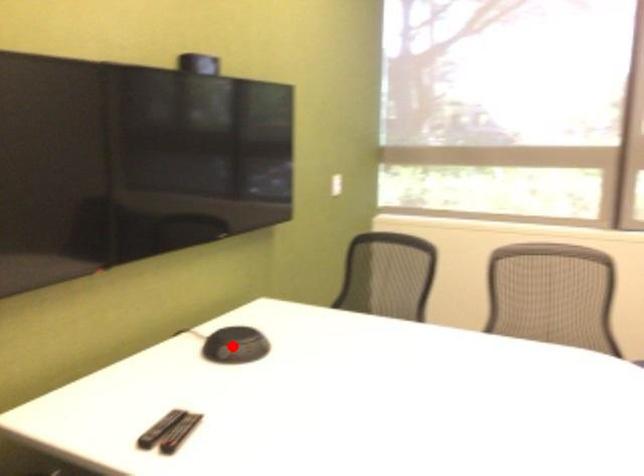
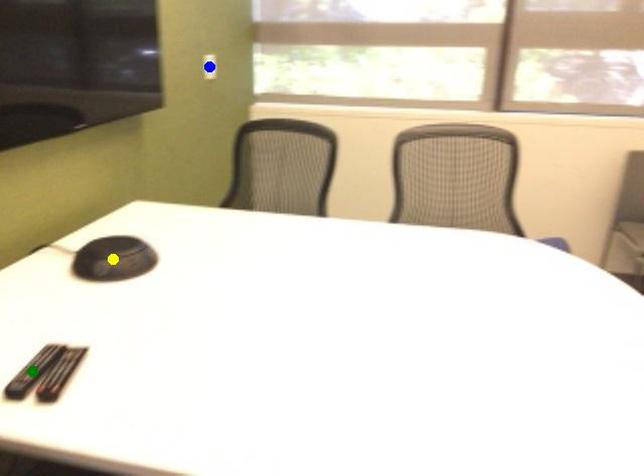
Question: I am providing you with two images of the same scene from different viewpoints. A red point is marked on the first image. You are given multiple points on the second image. Which point in image 2 is actually the same real-world point as the red point in image 1?

Choices:
 (A) blue point
 (B) yellow point
 (C) green point

Answer: (B)